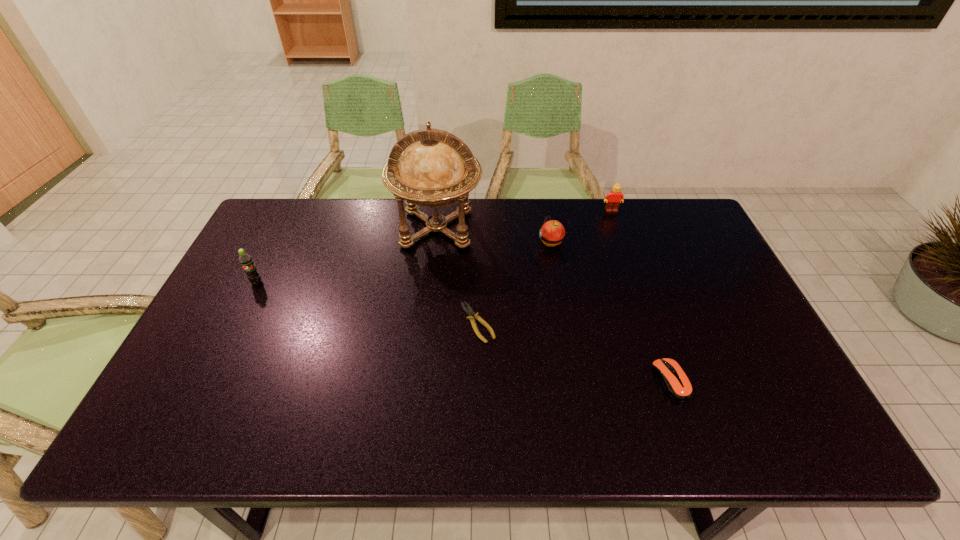
Find the location of `vacant space at the far edge of the desktop`. vacant space at the far edge of the desktop is located at coordinates (556, 211).

You are a GUI agent. You are given a task and a screenshot of the screen. Output one action in this format:
    pyautogui.click(x=<x>, y=<y>)
    Task: Click on the vacant region at the near edge of the desktop
    
    Given the screenshot: What is the action you would take?
    pyautogui.click(x=336, y=415)

You are a GUI agent. You are given a task and a screenshot of the screen. Output one action in this format:
    pyautogui.click(x=<x>, y=<y>)
    Task: Click on the free region at the left edge of the desktop
    This screenshot has width=960, height=540.
    Given the screenshot: What is the action you would take?
    pyautogui.click(x=245, y=277)

You are a GUI agent. You are given a task and a screenshot of the screen. Output one action in this format:
    pyautogui.click(x=<x>, y=<y>)
    Task: Click on the vacant space at the right edge of the desktop
    This screenshot has width=960, height=540.
    Given the screenshot: What is the action you would take?
    pyautogui.click(x=747, y=340)

The image size is (960, 540). Find the location of `vacant space at the near left corner`. vacant space at the near left corner is located at coordinates (203, 424).

Find the location of a particular element. The width and height of the screenshot is (960, 540). free region at the far right corner is located at coordinates (687, 204).

At what (x,y) coordinates should I click in order to perform the action: click on vacant area that lies between the pliers and the globe. Please return your answer as a coordinate pair (x, y). The width and height of the screenshot is (960, 540). Looking at the image, I should click on (458, 275).

This screenshot has height=540, width=960. I want to click on free spot between the globe and the fourth farthest object, so click(x=347, y=255).

I want to click on free space between the nearest object and the globe, so click(x=554, y=305).

Locate an element on the screen. Image resolution: width=960 pixels, height=540 pixels. unoccupied area between the leftmost object and the computer mouse is located at coordinates (464, 332).